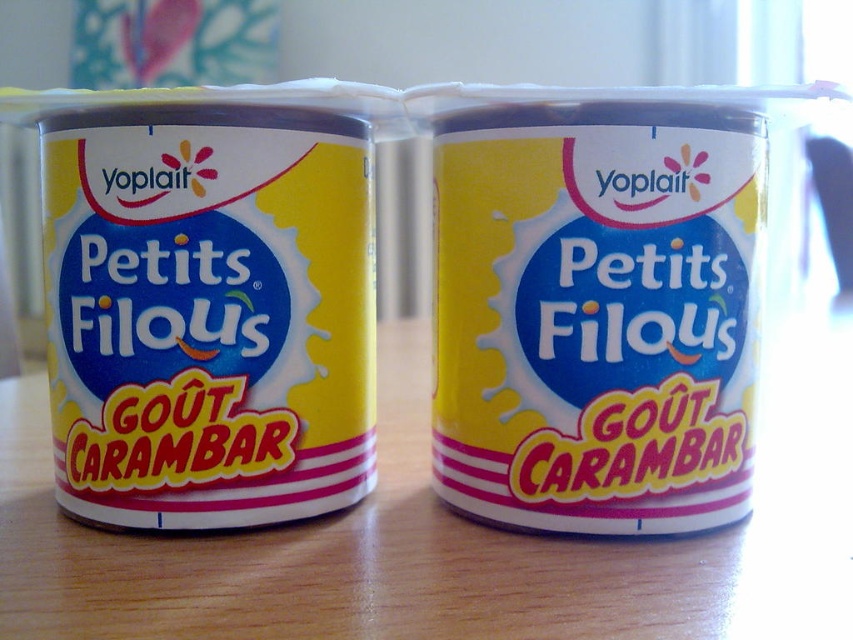
Question: Can you confirm if yellow matte plastic petits filous at left is positioned below yellow matte plastic petits filous at center?

Choices:
 (A) yes
 (B) no

Answer: (B)

Question: Does yellow matte plastic petits filous at left appear on the right side of yellow matte plastic petits filous at center?

Choices:
 (A) no
 (B) yes

Answer: (A)

Question: Which point appears closest to the camera in this image?

Choices:
 (A) (344, 109)
 (B) (473, 349)

Answer: (A)

Question: Among these objects, which one is farthest from the camera?

Choices:
 (A) yellow matte plastic petits filous at center
 (B) yellow matte plastic petits filous at left

Answer: (A)

Question: Where is yellow matte plastic petits filous at left located in relation to yellow matte plastic petits filous at center in the image?

Choices:
 (A) left
 (B) right

Answer: (A)